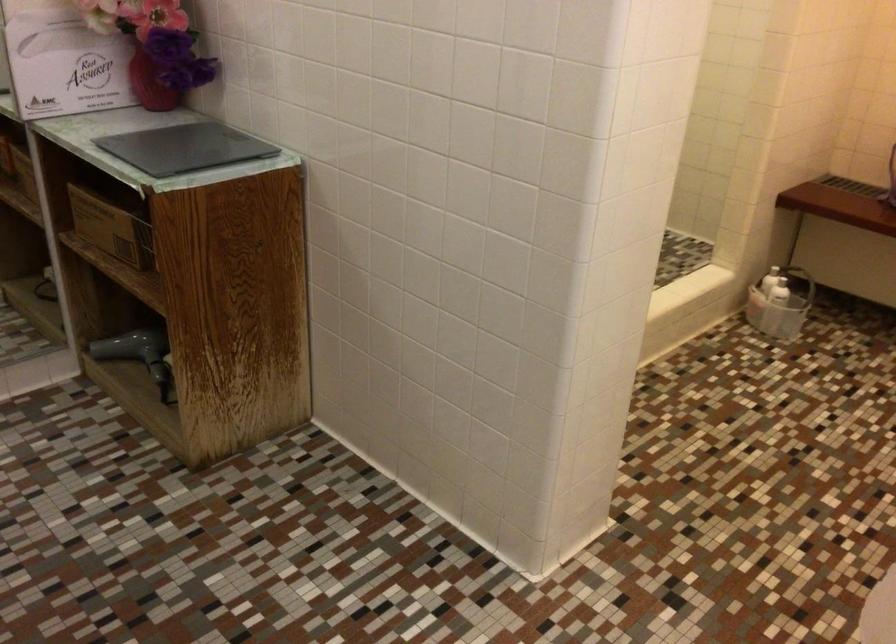
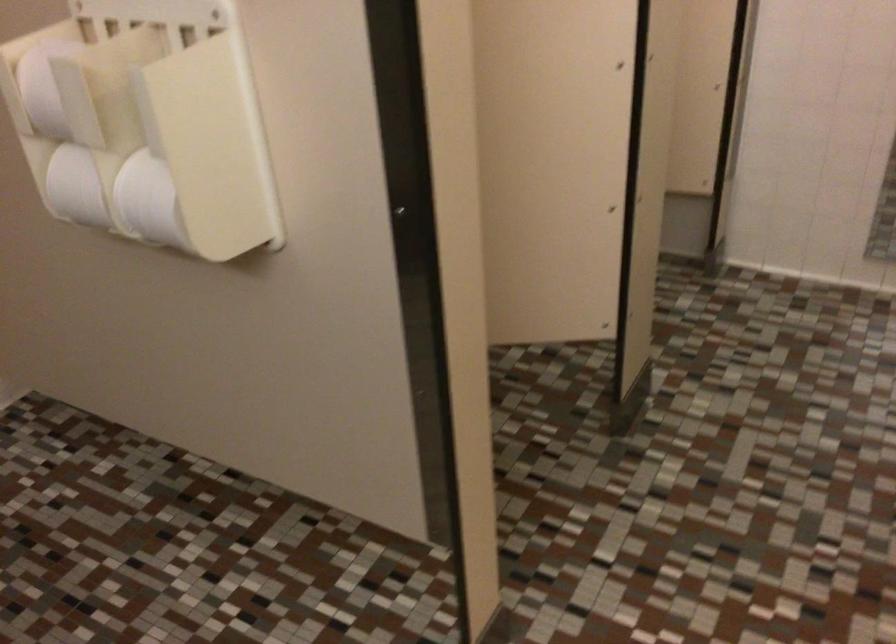
Based on the continuous images, in which direction is the camera rotating?

The camera's rotation is toward left-down.